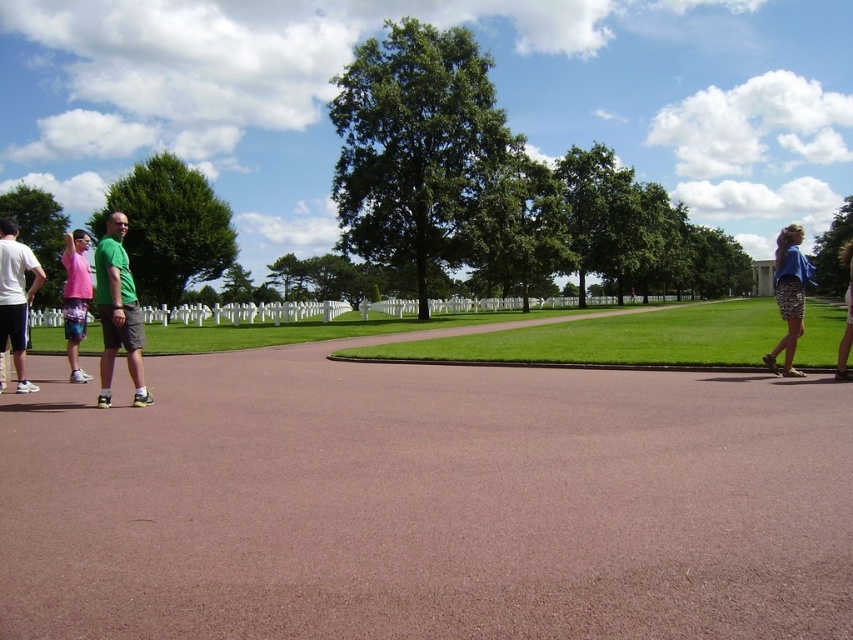
You are standing at point (x=807, y=282) and want to walk to point (x=103, y=358). Is the path between these two points clear of any obstructions?

The path between point (x=103, y=358) and point (x=807, y=282) is clear since there are no obstructions mentioned in the scene description. The scene describes a wide, smooth, reddish brown paved pathway that curves gently to the right with several individuals walking or standing, but none are blocking the path between these two points.

You are a photographer trying to capture both the green matte shorts at center and the blue printed skirt at right in a single frame. Which of the two objects should you focus on first to ensure both are in focus?

The green matte shorts at center is smaller than the blue printed skirt at right, so you should focus on the blue printed skirt at right first to ensure both are in focus.